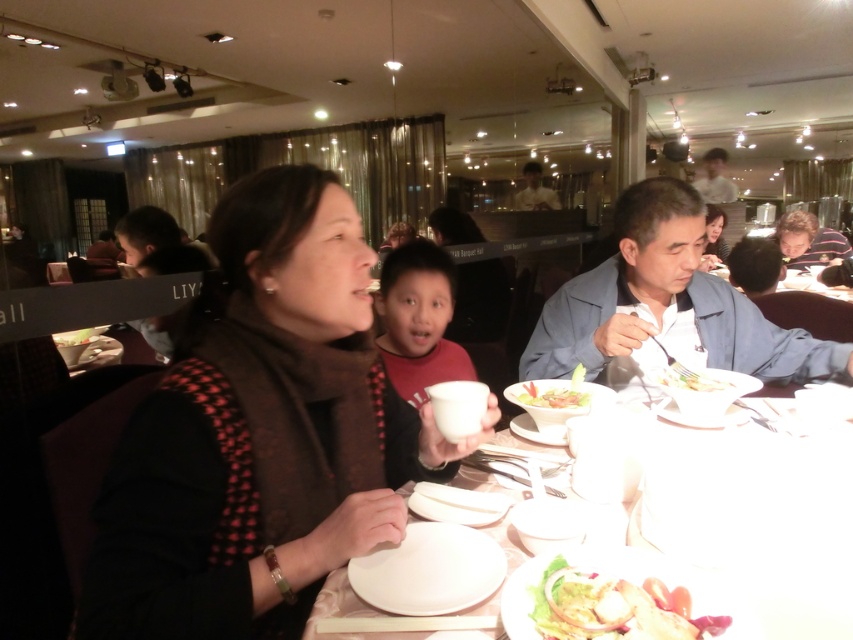
You are a waiter in a restaurant. You need to place a new menu on the table between the white glossy shirt at upper center and the white glossy salad bowl at center. Since the table is narrow, you must ensure that the menu won t be too wide. Which object s width can help you determine the maximum allowable width for the menu?

The white glossy salad bowl at center has a smaller width than the white glossy shirt at upper center. Therefore, the maximum allowable width for the menu should not exceed the width of the white glossy salad bowl at center to ensure it fits between them.

You are a photographer standing in the dining area and want to take a photo of the white glossy shirt at upper center and the white glossy salad bowl at center. Which object is closer to you?

The white glossy shirt at upper center is closer to you because it is further to the viewer than the white glossy salad bowl at center.